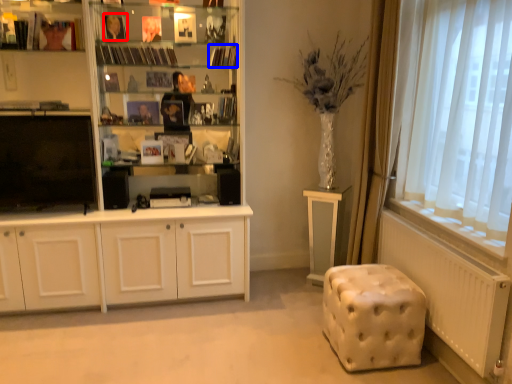
Question: Which point is further to the camera, book (highlighted by a red box) or book (highlighted by a blue box)?

Choices:
 (A) book
 (B) book

Answer: (B)